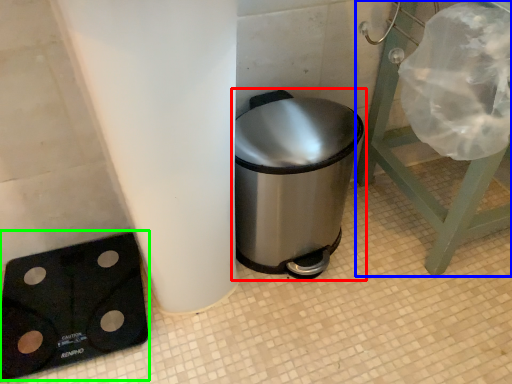
Question: Which object is the closest to the waste container (highlighted by a red box)? Choose among these: furniture (highlighted by a blue box) or weight scale (highlighted by a green box).

Choices:
 (A) furniture
 (B) weight scale

Answer: (A)